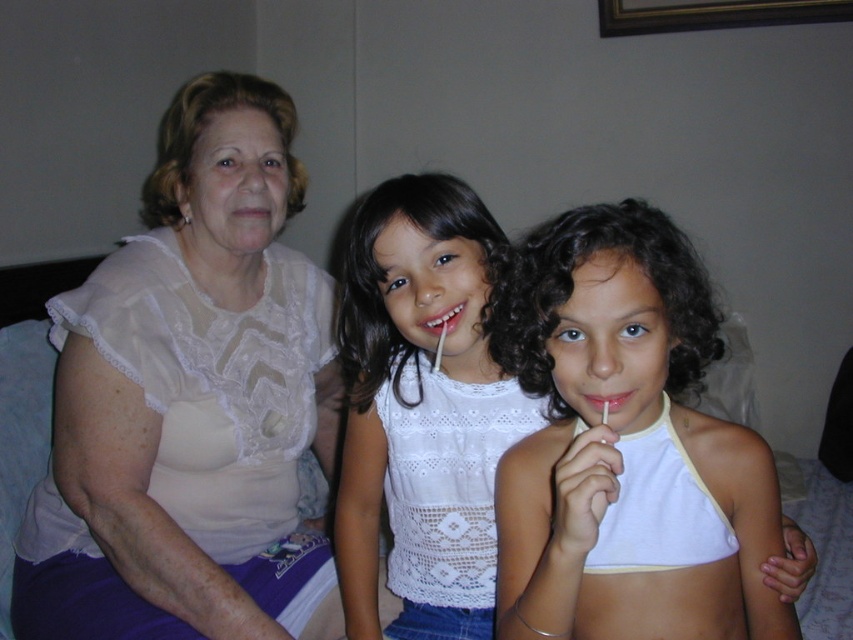
Question: Estimate the real-world distances between objects in this image. Which object is farther from the white lace blouse at left?

Choices:
 (A) matte pink lips at center
 (B) white glossy toothbrush at center
 (C) white lace shirt at center

Answer: (A)

Question: In this image, where is white cotton halter top at center located relative to white glossy toothbrush at center?

Choices:
 (A) above
 (B) below

Answer: (B)

Question: Is white lace blouse at left above white glossy toothbrush at center?

Choices:
 (A) no
 (B) yes

Answer: (A)

Question: Which point is closer to the camera?

Choices:
 (A) matte pink lips at center
 (B) white lace blouse at left
 (C) white glossy toothbrush at center
 (D) white lace shirt at center

Answer: (A)

Question: Is white glossy toothbrush at center further to the viewer compared to matte pink lips at center?

Choices:
 (A) no
 (B) yes

Answer: (B)

Question: Which object appears closest to the camera in this image?

Choices:
 (A) matte pink lips at center
 (B) white glossy toothbrush at center
 (C) white lace shirt at center
 (D) white cotton halter top at center

Answer: (D)